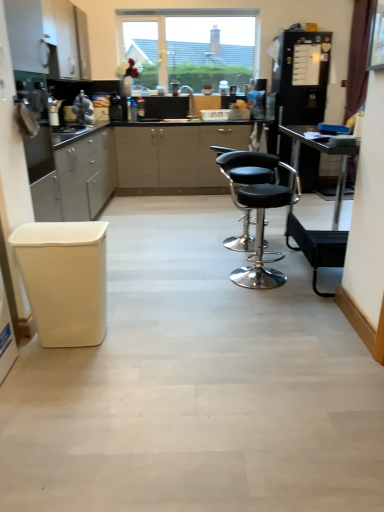
You are a GUI agent. You are given a task and a screenshot of the screen. Output one action in this format:
    pyautogui.click(x=<x>, y=<y>)
    Task: Click on the white matte cabinet at upper left
    The width and height of the screenshot is (384, 512).
    Given the screenshot: What is the action you would take?
    pyautogui.click(x=67, y=38)

I want to click on satin black coffee machine at upper left, marked as the 2th appliance in a right-to-left arrangement, so click(x=115, y=106).

The height and width of the screenshot is (512, 384). What do you see at coordinates (317, 247) in the screenshot?
I see `black leather bar stool at right, placed as the first bar stool when sorted from right to left` at bounding box center [317, 247].

Locate an element on the screen. The height and width of the screenshot is (512, 384). black matte refrigerator at right, the 1th appliance from the right is located at coordinates pyautogui.click(x=302, y=76).

Measure the distance between point (30, 143) and camera.

Point (30, 143) is 7.92 feet away from camera.

The width and height of the screenshot is (384, 512). What are the coordinates of `white matte cabinet at upper left` in the screenshot? It's located at (67, 38).

Can you confirm if satin black coffee machine at upper left, marked as the 2th appliance in a right-to-left arrangement, is smaller than black matte refrigerator at right, the 3th appliance in the front-to-back sequence?

Indeed, satin black coffee machine at upper left, marked as the 2th appliance in a right-to-left arrangement, has a smaller size compared to black matte refrigerator at right, the 3th appliance in the front-to-back sequence.

From the image's perspective, does satin black coffee machine at upper left, acting as the fourth appliance starting from the front, appear lower than black matte refrigerator at right, the 2th appliance viewed from the back?

Actually, satin black coffee machine at upper left, acting as the fourth appliance starting from the front, appears above black matte refrigerator at right, the 2th appliance viewed from the back, in the image.

From a real-world perspective, which is physically above, satin black coffee machine at upper left, marked as the 2th appliance in a right-to-left arrangement, or black matte refrigerator at right, which ranks as the fourth appliance in left-to-right order?

satin black coffee machine at upper left, marked as the 2th appliance in a right-to-left arrangement, is physically above.

Which is more to the right, satin black coffee machine at upper left, acting as the fourth appliance starting from the front, or black matte refrigerator at right, the 1th appliance from the right?

black matte refrigerator at right, the 1th appliance from the right, is more to the right.

Considering the sizes of objects satin silver statue at upper left, arranged as the 2th appliance when viewed from the front, and black leather stool at center in the image provided, who is shorter, satin silver statue at upper left, arranged as the 2th appliance when viewed from the front, or black leather stool at center?

satin silver statue at upper left, arranged as the 2th appliance when viewed from the front.

Is satin silver statue at upper left, the 1th appliance viewed from the left, far from black leather stool at center?

Yes, satin silver statue at upper left, the 1th appliance viewed from the left, is far from black leather stool at center.

You are a GUI agent. You are given a task and a screenshot of the screen. Output one action in this format:
    pyautogui.click(x=<x>, y=<y>)
    Task: Click on the chair on the right side of satin silver statue at upper left, which ranks as the third appliance in back-to-front order
    
    Given the screenshot: What is the action you would take?
    pyautogui.click(x=259, y=214)

Considering the relative positions of satin silver statue at upper left, arranged as the 2th appliance when viewed from the front, and black leather stool at center in the image provided, is satin silver statue at upper left, arranged as the 2th appliance when viewed from the front, to the left of black leather stool at center from the viewer's perspective?

Yes, satin silver statue at upper left, arranged as the 2th appliance when viewed from the front, is to the left of black leather stool at center.

Between black matte refrigerator at right, which ranks as the fourth appliance in left-to-right order, and metallic stainless steel oven at left, the second appliance positioned from the left, which one appears on the left side from the viewer's perspective?

metallic stainless steel oven at left, the second appliance positioned from the left.

Are black matte refrigerator at right, which ranks as the fourth appliance in left-to-right order, and metallic stainless steel oven at left, arranged as the third appliance when viewed from the right, beside each other?

No, black matte refrigerator at right, which ranks as the fourth appliance in left-to-right order, is not beside metallic stainless steel oven at left, arranged as the third appliance when viewed from the right.

Is black matte refrigerator at right, the 2th appliance viewed from the back, further to the viewer compared to metallic stainless steel oven at left, the second appliance positioned from the left?

Yes, black matte refrigerator at right, the 2th appliance viewed from the back, is further from the camera.

Is black matte refrigerator at right, the 3th appliance in the front-to-back sequence, positioned beyond the bounds of metallic stainless steel oven at left, arranged as the third appliance when viewed from the right?

That's correct, black matte refrigerator at right, the 3th appliance in the front-to-back sequence, is outside of metallic stainless steel oven at left, arranged as the third appliance when viewed from the right.

From a real-world perspective, which is physically above, metallic stainless steel oven at left, arranged as the third appliance when viewed from the right, or white woven bar stool at left, which is the 1th bar stool from front to back?

metallic stainless steel oven at left, arranged as the third appliance when viewed from the right, is physically above.

Who is smaller, metallic stainless steel oven at left, arranged as the third appliance when viewed from the right, or white woven bar stool at left, which is the 2th bar stool in right-to-left order?

white woven bar stool at left, which is the 2th bar stool in right-to-left order, is smaller.

From the image's perspective, which one is positioned lower, metallic stainless steel oven at left, the 4th appliance viewed from the back, or white woven bar stool at left, the first bar stool from the left?

From the image's view, white woven bar stool at left, the first bar stool from the left, is below.

Between white matte cabinet at upper left and satin black coffee machine at upper left, acting as the fourth appliance starting from the front, which one is positioned in front?

white matte cabinet at upper left.

Considering the sizes of white matte cabinet at upper left and satin black coffee machine at upper left, acting as the fourth appliance starting from the front, in the image, is white matte cabinet at upper left wider or thinner than satin black coffee machine at upper left, acting as the fourth appliance starting from the front,?

In the image, white matte cabinet at upper left appears to be wider than satin black coffee machine at upper left, acting as the fourth appliance starting from the front.

Considering the relative positions of white matte cabinet at upper left and satin black coffee machine at upper left, the third appliance when ordered from left to right, in the image provided, is white matte cabinet at upper left to the left of satin black coffee machine at upper left, the third appliance when ordered from left to right, from the viewer's perspective?

Indeed, white matte cabinet at upper left is positioned on the left side of satin black coffee machine at upper left, the third appliance when ordered from left to right.

From the picture: From the image's perspective, is white matte cabinet at upper left on top of satin black coffee machine at upper left, which ranks as the first appliance in back-to-front order?

Yes, from the image's perspective, white matte cabinet at upper left is above satin black coffee machine at upper left, which ranks as the first appliance in back-to-front order.

Which is in front, black matte refrigerator at right, which ranks as the fourth appliance in left-to-right order, or white matte cabinet at upper left?

white matte cabinet at upper left is closer to the camera.

Considering the sizes of objects black matte refrigerator at right, the 3th appliance in the front-to-back sequence, and white matte cabinet at upper left in the image provided, who is shorter, black matte refrigerator at right, the 3th appliance in the front-to-back sequence, or white matte cabinet at upper left?

With less height is white matte cabinet at upper left.

Can you tell me how much black matte refrigerator at right, the 2th appliance viewed from the back, and white matte cabinet at upper left differ in facing direction?

89.2 degrees.

Considering the relative positions of black matte refrigerator at right, which ranks as the fourth appliance in left-to-right order, and white matte cabinet at upper left in the image provided, is black matte refrigerator at right, which ranks as the fourth appliance in left-to-right order, to the left of white matte cabinet at upper left from the viewer's perspective?

No.

Which of these two, satin silver statue at upper left, marked as the fourth appliance in a right-to-left arrangement, or black leather bar stool at right, marked as the 2th bar stool in a left-to-right arrangement, is bigger?

With larger size is black leather bar stool at right, marked as the 2th bar stool in a left-to-right arrangement.

Which of these two, satin silver statue at upper left, which ranks as the third appliance in back-to-front order, or black leather bar stool at right, placed as the first bar stool when sorted from right to left, stands taller?

satin silver statue at upper left, which ranks as the third appliance in back-to-front order.

Is satin silver statue at upper left, arranged as the 2th appliance when viewed from the front, oriented away from black leather bar stool at right, positioned as the 1th bar stool in back-to-front order?

No.

Find the location of `appliance lying above the black matte refrigerator at right, which ranks as the fourth appliance in left-to-right order (from the image's perspective)`. appliance lying above the black matte refrigerator at right, which ranks as the fourth appliance in left-to-right order (from the image's perspective) is located at coordinates (115, 106).

The image size is (384, 512). I want to click on chair on the right of satin silver statue at upper left, which ranks as the third appliance in back-to-front order, so click(259, 214).

From the picture: Estimate the real-world distances between objects in this image. Which object is further from satin black coffee machine at upper left, which ranks as the first appliance in back-to-front order, black leather stool at center or black matte refrigerator at right, the 1th appliance from the right?

Based on the image, black leather stool at center appears to be further to satin black coffee machine at upper left, which ranks as the first appliance in back-to-front order.

Considering their positions, is metallic stainless steel oven at left, arranged as the third appliance when viewed from the right, positioned closer to white matte cabinet at upper left than satin silver statue at upper left, the 1th appliance viewed from the left?

The object closer to white matte cabinet at upper left is satin silver statue at upper left, the 1th appliance viewed from the left.

Looking at the image, which one is located closer to white woven bar stool at left, which is the second bar stool in back-to-front order, black matte refrigerator at right, the 2th appliance viewed from the back, or satin silver statue at upper left, which ranks as the third appliance in back-to-front order?

satin silver statue at upper left, which ranks as the third appliance in back-to-front order.

Estimate the real-world distances between objects in this image. Which object is closer to black leather bar stool at right, positioned as the 1th bar stool in back-to-front order, black matte refrigerator at right, the 3th appliance in the front-to-back sequence, or metallic stainless steel oven at left, the 1th appliance when ordered from front to back?

metallic stainless steel oven at left, the 1th appliance when ordered from front to back.

Based on the photo, from the image, which object appears to be nearer to clear glass window at upper center, black leather bar stool at right, marked as the 2th bar stool in a left-to-right arrangement, or black matte refrigerator at right, the 1th appliance from the right?

black matte refrigerator at right, the 1th appliance from the right, is positioned closer to the anchor clear glass window at upper center.

From the image, which object appears to be farther from black leather stool at center, black leather bar stool at right, placed as the first bar stool when sorted from right to left, or metallic stainless steel oven at left, the 1th appliance when ordered from front to back?

Among the two, metallic stainless steel oven at left, the 1th appliance when ordered from front to back, is located further to black leather stool at center.

Based on their spatial positions, is black leather stool at center or white woven bar stool at left, which is the 1th bar stool from front to back, further from satin black coffee machine at upper left, which ranks as the first appliance in back-to-front order?

white woven bar stool at left, which is the 1th bar stool from front to back, lies further to satin black coffee machine at upper left, which ranks as the first appliance in back-to-front order, than the other object.

Estimate the real-world distances between objects in this image. Which object is further from black matte refrigerator at right, the 3th appliance in the front-to-back sequence, black leather stool at center or white matte cabinet at upper left?

Based on the image, white matte cabinet at upper left appears to be further to black matte refrigerator at right, the 3th appliance in the front-to-back sequence.

Find the location of a particular element. The image size is (384, 512). bar stool positioned between black leather stool at center and clear glass window at upper center from near to far is located at coordinates (x=317, y=247).

The image size is (384, 512). In order to click on cabinetry between metallic stainless steel oven at left, arranged as the third appliance when viewed from the right, and satin black coffee machine at upper left, marked as the 2th appliance in a right-to-left arrangement, in the front-back direction in this screenshot , I will do `click(67, 38)`.

Where is `window between satin black coffee machine at upper left, acting as the fourth appliance starting from the front, and black matte refrigerator at right, the 3th appliance in the front-to-back sequence`? window between satin black coffee machine at upper left, acting as the fourth appliance starting from the front, and black matte refrigerator at right, the 3th appliance in the front-to-back sequence is located at coordinates 190,46.

The height and width of the screenshot is (512, 384). I want to click on bar stool between white woven bar stool at left, which is the 2th bar stool in right-to-left order, and black matte refrigerator at right, the 1th appliance from the right, along the z-axis, so click(317, 247).